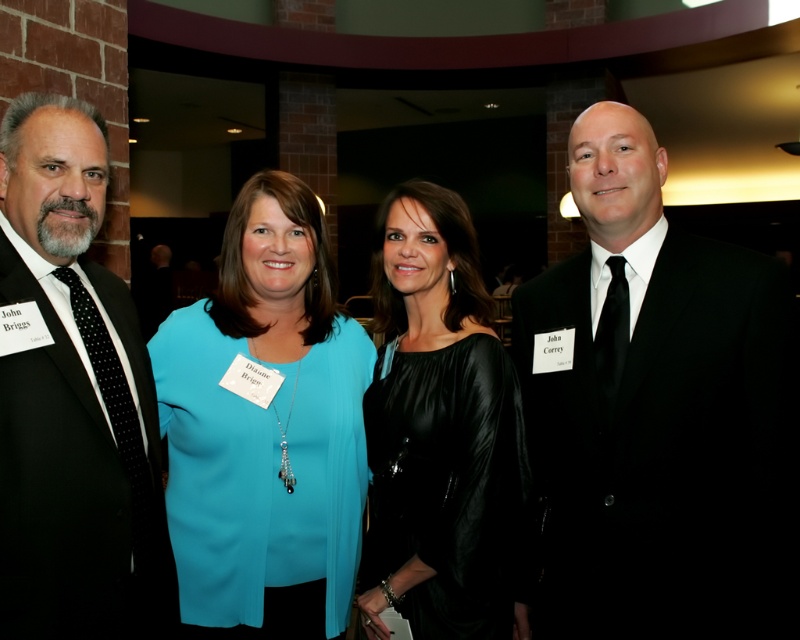
Is point (636, 256) positioned before point (140, 422)?

No.

Between black suit at right and black suit at left, which one has less height?

With less height is black suit at left.

Who is more distant from viewer, [709,417] or [90,502]?

The point [709,417] is behind.

Find the location of a particular element. This screenshot has height=640, width=800. black suit at right is located at coordinates (656, 410).

Measure the distance between teal fabric blouse at center and black satin dress at center.

teal fabric blouse at center and black satin dress at center are 10.06 inches apart from each other.

At what (x,y) coordinates should I click in order to perform the action: click on teal fabric blouse at center. Please return your answer as a coordinate pair (x, y). Image resolution: width=800 pixels, height=640 pixels. Looking at the image, I should click on (266, 429).

The image size is (800, 640). I want to click on teal fabric blouse at center, so click(266, 429).

Is black suit at right to the left of black satin dress at center from the viewer's perspective?

Incorrect, black suit at right is not on the left side of black satin dress at center.

Does black suit at right come behind black satin dress at center?

No, black suit at right is in front of black satin dress at center.

Identify the location of black suit at right. (656, 410).